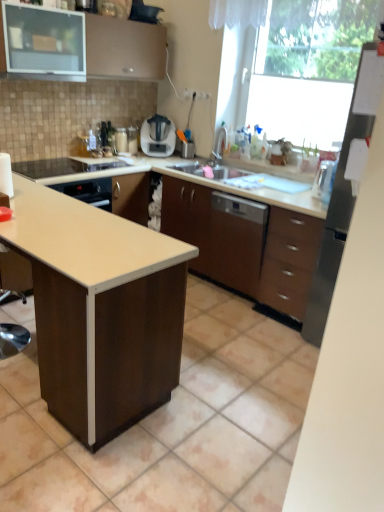
Question: Can you confirm if transparent glass window at upper right is shorter than satin silver blender at center?

Choices:
 (A) no
 (B) yes

Answer: (A)

Question: Does transparent glass window at upper right have a smaller size compared to satin silver blender at center?

Choices:
 (A) no
 (B) yes

Answer: (A)

Question: From a real-world perspective, is transparent glass window at upper right physically above satin silver blender at center?

Choices:
 (A) yes
 (B) no

Answer: (A)

Question: From the image's perspective, does transparent glass window at upper right appear lower than satin silver blender at center?

Choices:
 (A) yes
 (B) no

Answer: (B)

Question: Is transparent glass window at upper right wider than satin silver blender at center?

Choices:
 (A) yes
 (B) no

Answer: (A)

Question: Considering the relative positions of transparent glass window at upper right and satin silver blender at center in the image provided, is transparent glass window at upper right to the left of satin silver blender at center from the viewer's perspective?

Choices:
 (A) yes
 (B) no

Answer: (B)

Question: Is satin nickel faucet at upper right facing away from satin silver blender at center?

Choices:
 (A) no
 (B) yes

Answer: (A)

Question: Is satin nickel faucet at upper right next to satin silver blender at center and touching it?

Choices:
 (A) yes
 (B) no

Answer: (B)

Question: Is satin silver blender at center surrounded by satin nickel faucet at upper right?

Choices:
 (A) yes
 (B) no

Answer: (B)

Question: Considering the relative sizes of satin nickel faucet at upper right and satin silver blender at center in the image provided, is satin nickel faucet at upper right smaller than satin silver blender at center?

Choices:
 (A) yes
 (B) no

Answer: (A)

Question: Does satin nickel faucet at upper right have a lesser height compared to satin silver blender at center?

Choices:
 (A) no
 (B) yes

Answer: (B)

Question: Considering the relative sizes of satin nickel faucet at upper right and satin silver blender at center in the image provided, is satin nickel faucet at upper right taller than satin silver blender at center?

Choices:
 (A) no
 (B) yes

Answer: (A)

Question: Is stainless steel refrigerator at right closer to camera compared to matte brown cabinet at upper left, marked as the first cabinetry in a left-to-right arrangement?

Choices:
 (A) yes
 (B) no

Answer: (A)